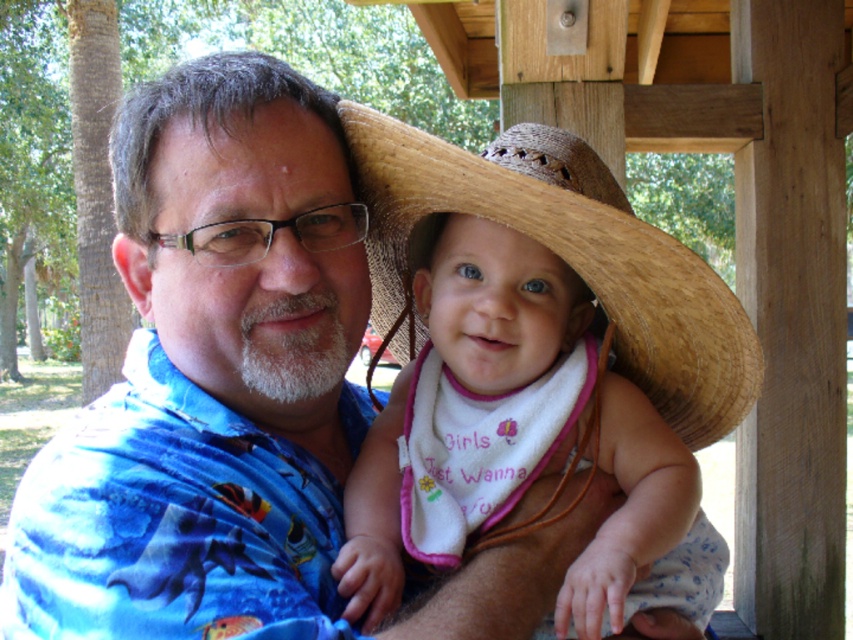
Is point (389, 570) positioned after point (374, 147)?

No, (389, 570) is closer to viewer.

Where is `white cotton bib at center`? This screenshot has height=640, width=853. white cotton bib at center is located at coordinates (502, 312).